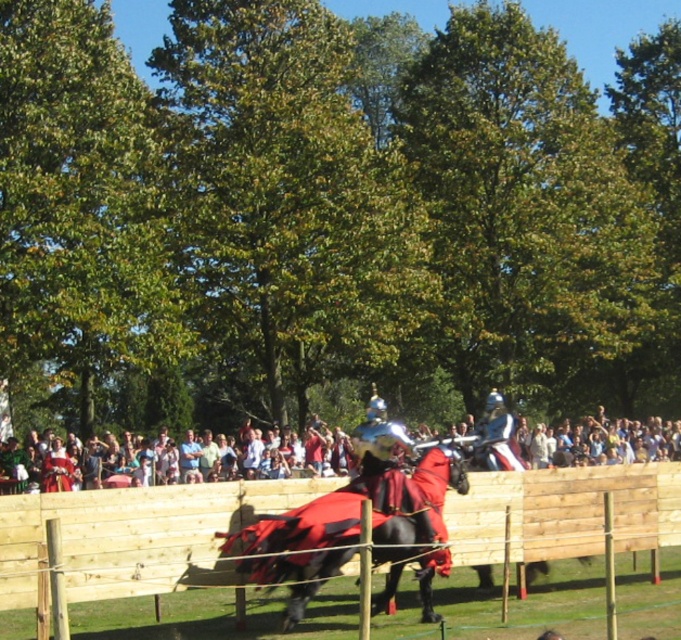
Question: Which point appears farthest from the camera in this image?

Choices:
 (A) (459, 550)
 (B) (538, 426)
 (C) (285, 531)

Answer: (B)

Question: Which point is farther to the camera?

Choices:
 (A) white cotton shirt at center
 (B) shiny red fabric horse at center

Answer: (A)

Question: Is wooden at center smaller than white cotton shirt at center?

Choices:
 (A) yes
 (B) no

Answer: (A)

Question: Among these objects, which one is farthest from the camera?

Choices:
 (A) white cotton shirt at center
 (B) shiny red fabric horse at center

Answer: (A)

Question: Is white cotton shirt at center in front of shiny red fabric horse at center?

Choices:
 (A) yes
 (B) no

Answer: (B)

Question: Does wooden at center come behind white cotton shirt at center?

Choices:
 (A) no
 (B) yes

Answer: (A)